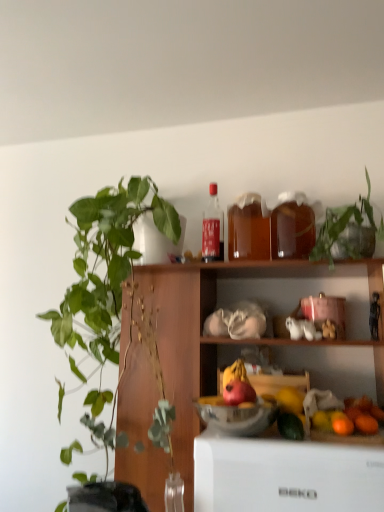
Question: In terms of width, does red matte apple at center look wider or thinner when compared to green matte avocado at lower center?

Choices:
 (A) wide
 (B) thin

Answer: (B)

Question: From a real-world perspective, is red matte apple at center positioned above or below green matte avocado at lower center?

Choices:
 (A) below
 (B) above

Answer: (B)

Question: Which of these objects is positioned farthest from the translucent glass bottle at upper center, arranged as the 2th bottle when viewed from the right?

Choices:
 (A) translucent amber bottle at upper center, which ranks as the 1th bottle in right-to-left order
 (B) green leafy plant at left, which is counted as the first houseplant, starting from the left
 (C) matte glass bottle at upper center, positioned as the first bottle in left-to-right order
 (D) orange matte at lower right
 (E) orange matte at lower right

Answer: (E)

Question: Estimate the real-world distances between objects in this image. Which object is farther from the orange matte at lower right?

Choices:
 (A) translucent amber bottle at upper center, which is counted as the 3th bottle, starting from the left
 (B) orange matte at lower right
 (C) red matte apple at center
 (D) green matte avocado at lower center
 (E) metallic silver bowl at center

Answer: (A)